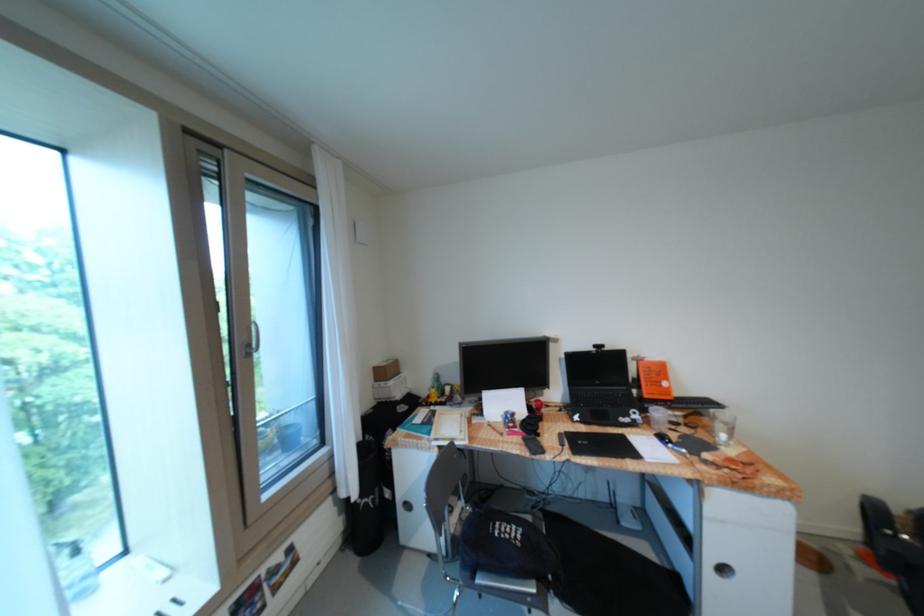
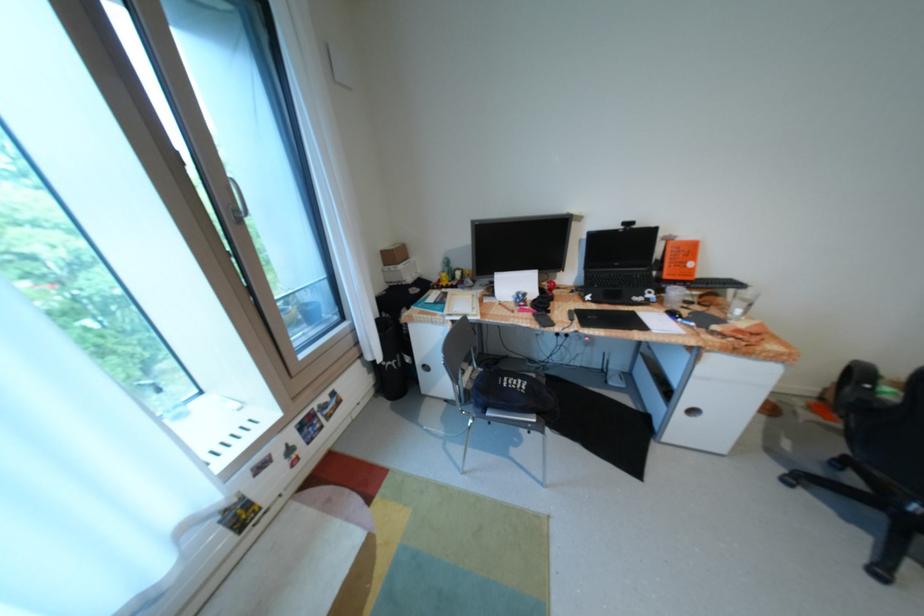
Locate, in the second image, the point that corresponds to point 715,419 in the first image.

(731, 301)